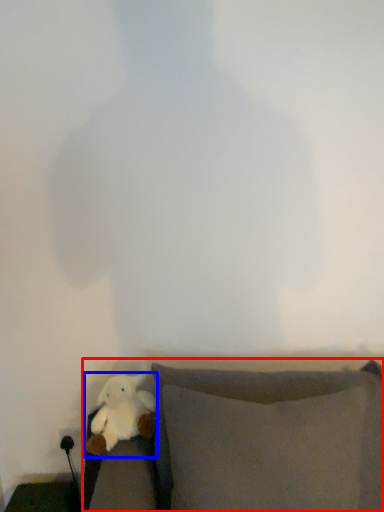
Question: Among these objects, which one is nearest to the camera, furniture (highlighted by a red box) or toy (highlighted by a blue box)?

Choices:
 (A) furniture
 (B) toy

Answer: (A)